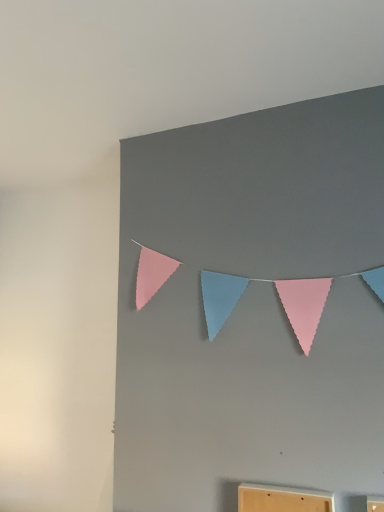
Question: Based on their positions, is pastel felt bunting at upper center located to the left or right of wooden cabinet at lower center?

Choices:
 (A) left
 (B) right

Answer: (A)

Question: From the image's perspective, is pastel felt bunting at upper center located above or below wooden cabinet at lower center?

Choices:
 (A) below
 (B) above

Answer: (B)

Question: From a real-world perspective, relative to wooden cabinet at lower center, is pastel felt bunting at upper center vertically above or below?

Choices:
 (A) below
 (B) above

Answer: (B)

Question: Considering the positions of wooden cabinet at lower center and pastel felt bunting at upper center in the image, is wooden cabinet at lower center wider or thinner than pastel felt bunting at upper center?

Choices:
 (A) thin
 (B) wide

Answer: (B)

Question: From a real-world perspective, is wooden cabinet at lower center positioned above or below pastel felt bunting at upper center?

Choices:
 (A) below
 (B) above

Answer: (A)

Question: In terms of size, does wooden cabinet at lower center appear bigger or smaller than pastel felt bunting at upper center?

Choices:
 (A) small
 (B) big

Answer: (A)

Question: Considering their positions, is wooden cabinet at lower center located in front of or behind pastel felt bunting at upper center?

Choices:
 (A) front
 (B) behind

Answer: (A)